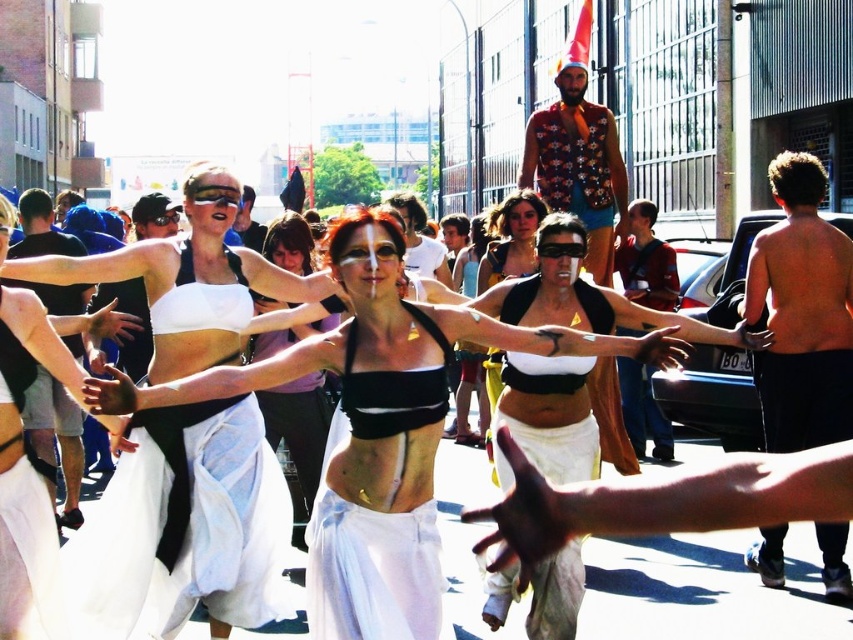
Question: Which point is closer to the camera taking this photo?

Choices:
 (A) (74, 465)
 (B) (757, 381)

Answer: (B)

Question: Which point is closer to the camera?

Choices:
 (A) (463, 280)
 (B) (485, 362)
 (C) (171, 625)
 (D) (598, 342)

Answer: (C)

Question: Is black matte bikini top at center above matte black bra at center?

Choices:
 (A) yes
 (B) no

Answer: (A)

Question: Can you confirm if black matte bikini top at center is positioned below matte black bra at center?

Choices:
 (A) no
 (B) yes

Answer: (A)

Question: Can you confirm if white matte skirt at center is wider than black fabric shorts at left?

Choices:
 (A) yes
 (B) no

Answer: (B)

Question: Which point is closer to the camera?

Choices:
 (A) black fabric shorts at left
 (B) shiny blue vest at center
 (C) matte black tank top at center
 (D) shiny black skin at right

Answer: (A)